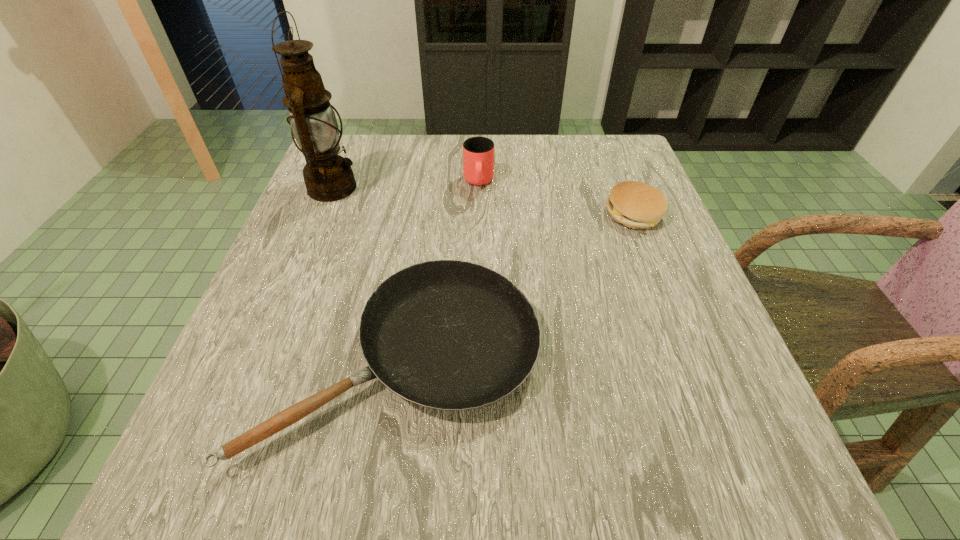
Identify the location of oil lamp. This screenshot has width=960, height=540. (328, 176).

I want to click on cup, so click(x=478, y=152).

This screenshot has height=540, width=960. I want to click on the second shortest object, so click(x=635, y=204).

Identify the location of the rightmost object. The width and height of the screenshot is (960, 540). (635, 204).

At what (x,y) coordinates should I click in order to perform the action: click on the nearest object. Please return your answer as a coordinate pair (x, y). Looking at the image, I should click on (452, 335).

Find the location of a particular element. This screenshot has height=540, width=960. the shortest object is located at coordinates (452, 335).

I want to click on vacant space located 0.260m on the front of the tallest object, so click(x=286, y=304).

I want to click on free space located 0.390m on the handle side of the cup, so click(478, 342).

You are a GUI agent. You are given a task and a screenshot of the screen. Output one action in this format:
    pyautogui.click(x=<x>, y=<y>)
    Task: Click on the vacant area located on the left of the rightmost object
    Image resolution: width=960 pixels, height=540 pixels.
    Given the screenshot: What is the action you would take?
    pyautogui.click(x=576, y=214)

Locate an element on the screen. This screenshot has width=960, height=540. vacant space located on the right of the frying pan is located at coordinates [684, 359].